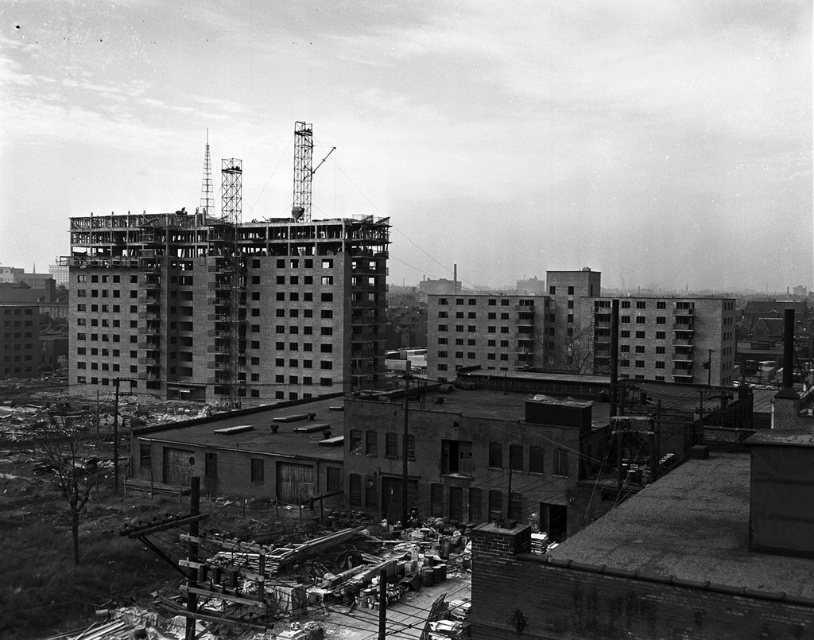
Is the position of exposed concrete foundation at center less distant than that of exposed concrete building at center?

Yes, exposed concrete foundation at center is closer to the viewer.

Measure the distance between exposed concrete foundation at center and exposed concrete building at center.

exposed concrete foundation at center is 49.54 meters from exposed concrete building at center.

Locate an element on the screen. exposed concrete foundation at center is located at coordinates tap(602, 529).

This screenshot has height=640, width=814. What are the coordinates of `exposed concrete foundation at center` in the screenshot? It's located at (602, 529).